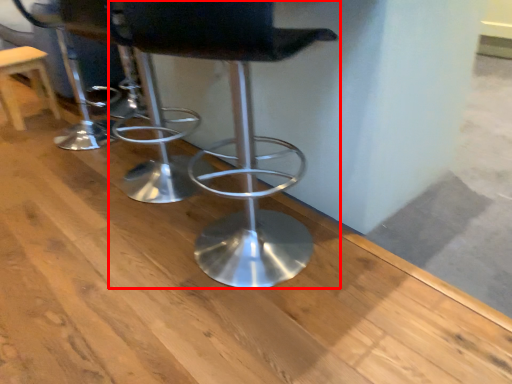
Question: From the image's perspective, what is the correct spatial positioning of chair (annotated by the red box) in reference to stool?

Choices:
 (A) above
 (B) below

Answer: (B)